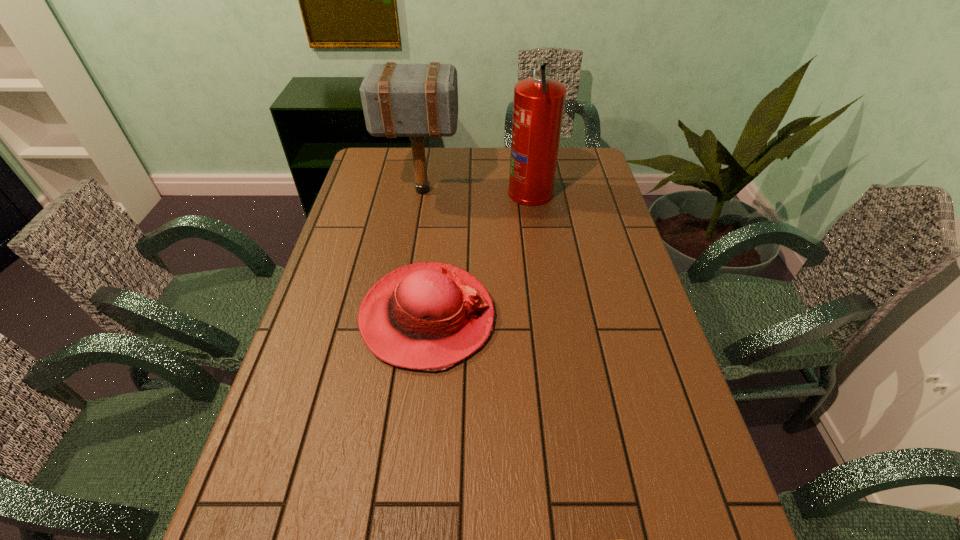
At what (x,y) coordinates should I click in order to perform the action: click on blank region between the mallet and the second nearest object. Please return your answer as a coordinate pair (x, y). The image size is (960, 540). Looking at the image, I should click on [x=424, y=254].

Identify the location of vacant area that lies between the mallet and the third farthest object. (424, 254).

Locate an element on the screen. empty space between the fire extinguisher and the hat is located at coordinates (479, 254).

Identify the location of free space between the fire extinguisher and the mallet. This screenshot has width=960, height=540. (476, 191).

This screenshot has height=540, width=960. I want to click on free spot between the second nearest object and the mallet, so click(424, 254).

Identify which object is the closest to the ping-pong ball. Please provide its 2D coordinates. Your answer should be formatted as a tuple, i.e. [(x, y)], where the tuple contains the x and y coordinates of a point satisfying the conditions above.

[(429, 316)]

At what (x,y) coordinates should I click in order to perform the action: click on object that is the closest to the nearest object. Please return your answer as a coordinate pair (x, y). The image size is (960, 540). Looking at the image, I should click on (429, 316).